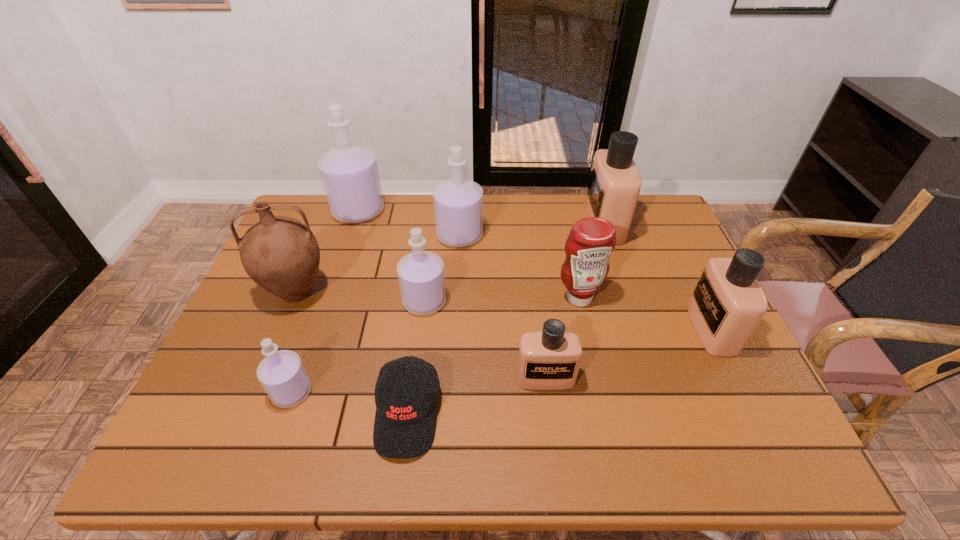
Image resolution: width=960 pixels, height=540 pixels. I want to click on blank region between the black baseball cap and the smallest purple perfume, so (x=349, y=403).

The height and width of the screenshot is (540, 960). Find the location of `unoccupied area between the condiment and the baseball cap`. unoccupied area between the condiment and the baseball cap is located at coordinates (493, 356).

Identify the location of empty space between the second biggest purple perfume and the second object from right to left. (532, 230).

Where is `object that is the second nearest to the tallest perfume`? The image size is (960, 540). object that is the second nearest to the tallest perfume is located at coordinates (281, 254).

Find the location of a particular element. object that is the closest to the pitcher is located at coordinates (282, 374).

Locate which perfume ranks sixth in proximity to the smallest beige perfume. Please provide its 2D coordinates. Your answer should be formatted as a tuple, i.e. [(x, y)], where the tuple contains the x and y coordinates of a point satisfying the conditions above.

[(349, 173)]

You are a GUI agent. You are given a task and a screenshot of the screen. Output one action in this format:
    pyautogui.click(x=<x>, y=<y>)
    Task: Click on the second closest perfume to the brown pitcher
    The image size is (960, 540).
    Given the screenshot: What is the action you would take?
    pyautogui.click(x=421, y=277)

Where is `the second closest purple perfume relative to the nearest purple perfume`? This screenshot has height=540, width=960. the second closest purple perfume relative to the nearest purple perfume is located at coordinates (458, 203).

Identify the location of the third closest purple perfume to the second nearest purple perfume. Image resolution: width=960 pixels, height=540 pixels. (349, 173).

Image resolution: width=960 pixels, height=540 pixels. Identify the location of beige perfume that stands as the second closest to the baseball cap. (615, 182).